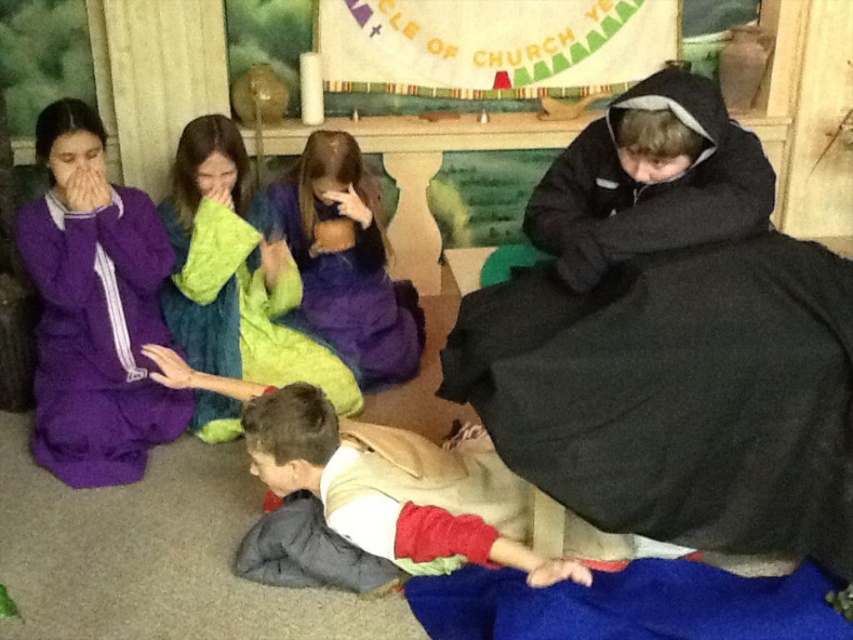
Is black fleece blanket at right to the right of green fuzzy blanket at center from the viewer's perspective?

Indeed, black fleece blanket at right is positioned on the right side of green fuzzy blanket at center.

From the picture: Does black fleece blanket at right have a larger size compared to green fuzzy blanket at center?

Yes, black fleece blanket at right is bigger than green fuzzy blanket at center.

Is point (752, 328) more distant than point (241, 198)?

No, it is in front of (241, 198).

This screenshot has width=853, height=640. I want to click on black fleece blanket at right, so click(670, 339).

Based on the photo, does purple fleece robe at left appear on the right side of purple fleece blanket at center?

Incorrect, purple fleece robe at left is not on the right side of purple fleece blanket at center.

Is point (45, 342) behind point (347, 248)?

No, it is in front of (347, 248).

Is point (103, 234) positioned after point (369, 385)?

That is False.

At what (x,y) coordinates should I click in order to perform the action: click on purple fleece robe at left. Please return your answer as a coordinate pair (x, y). This screenshot has width=853, height=640. Looking at the image, I should click on (94, 308).

Can you confirm if black fleece blanket at right is taller than tan fabric child at lower center?

Yes, black fleece blanket at right is taller than tan fabric child at lower center.

Looking at this image, who is more distant from viewer, [515,432] or [447,492]?

The point [447,492] is behind.

Between point (843, 349) and point (540, 573), which one is positioned behind?

Positioned behind is point (843, 349).

Identify the location of black fleece blanket at right. (670, 339).